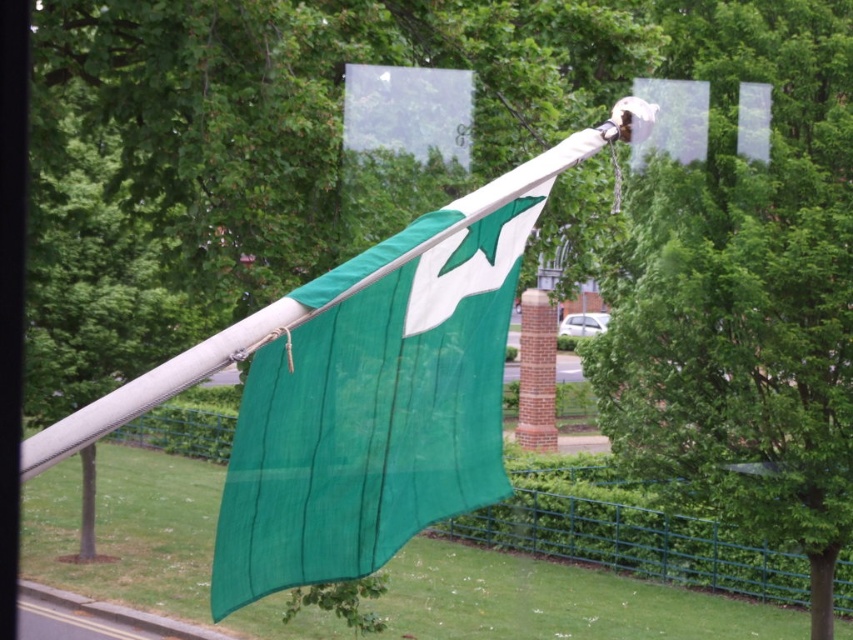
Which is behind, point (851, 52) or point (471, 336)?

Point (851, 52)

Measure the distance between green fabric tree at upper center and green fabric flag at center.

13.04 meters

Between point (631, 369) and point (425, 396), which one is positioned behind?

Point (631, 369)

Locate an element on the screen. Image resolution: width=853 pixels, height=640 pixels. green fabric tree at upper center is located at coordinates (746, 289).

In the scene shown: Is green fabric flag at center wider than green metal fence at lower center?

No, green fabric flag at center is not wider than green metal fence at lower center.

Measure the distance between point (225, 580) and camera.

A distance of 3.77 meters exists between point (225, 580) and camera.

Locate an element on the screen. This screenshot has width=853, height=640. green fabric flag at center is located at coordinates (381, 394).

The height and width of the screenshot is (640, 853). What are the coordinates of `green fabric flag at center` in the screenshot? It's located at (381, 394).

Is green fabric tree at upper center positioned before green metal fence at lower center?

Yes, it is.

Is green fabric tree at upper center below green metal fence at lower center?

Actually, green fabric tree at upper center is above green metal fence at lower center.

At what (x,y) coordinates should I click in order to perform the action: click on green fabric tree at upper center. Please return your answer as a coordinate pair (x, y). The image size is (853, 640). Looking at the image, I should click on tap(746, 289).